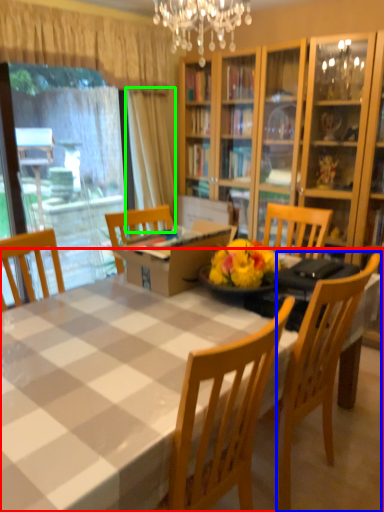
Question: Which object is positioned farthest from kitchen & dining room table (highlighted by a red box)? Select from chair (highlighted by a blue box) and curtain (highlighted by a green box).

Choices:
 (A) chair
 (B) curtain

Answer: (B)